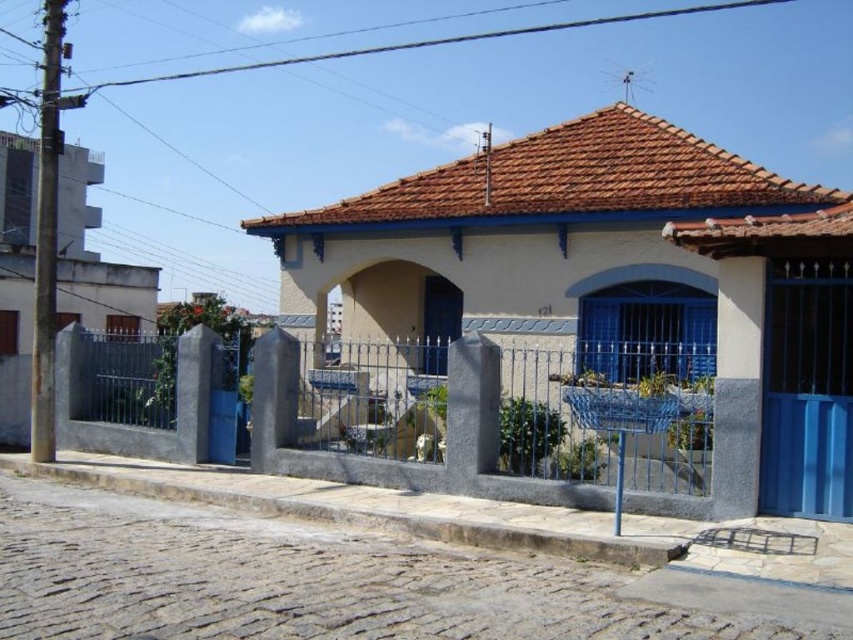
Question: Which object is farther from the camera taking this photo?

Choices:
 (A) brown tile roof at upper center
 (B) gray wrought iron fence at center

Answer: (A)

Question: Is gray wrought iron fence at center thinner than brown tile roof at upper center?

Choices:
 (A) yes
 (B) no

Answer: (B)

Question: Which object appears farthest from the camera in this image?

Choices:
 (A) brown tile roof at upper center
 (B) gray wrought iron fence at center

Answer: (A)

Question: Does gray wrought iron fence at center have a lesser width compared to brown tile roof at upper center?

Choices:
 (A) no
 (B) yes

Answer: (A)

Question: Is gray wrought iron fence at center behind brown tile roof at upper center?

Choices:
 (A) yes
 (B) no

Answer: (B)